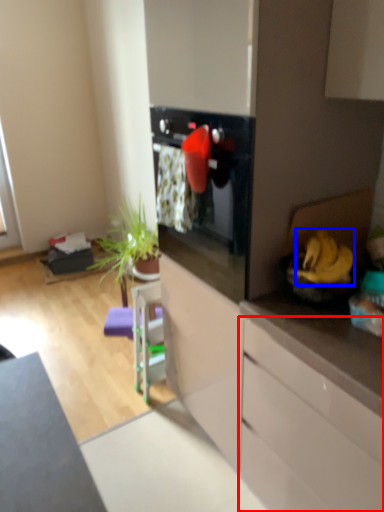
Question: Which point is further to the camera, cabinetry (highlighted by a red box) or banana (highlighted by a blue box)?

Choices:
 (A) cabinetry
 (B) banana

Answer: (B)